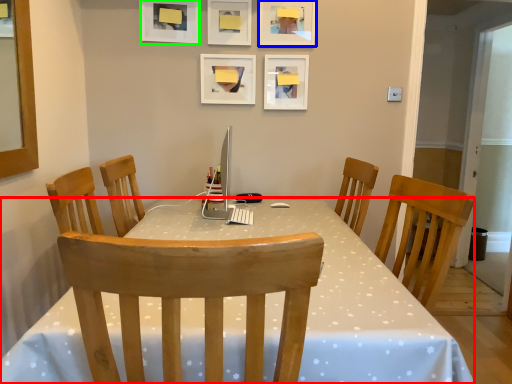
Question: Which object is positioned closest to desk (highlighted by a red box)? Select from picture frame (highlighted by a blue box) and picture frame (highlighted by a green box).

Choices:
 (A) picture frame
 (B) picture frame

Answer: (A)